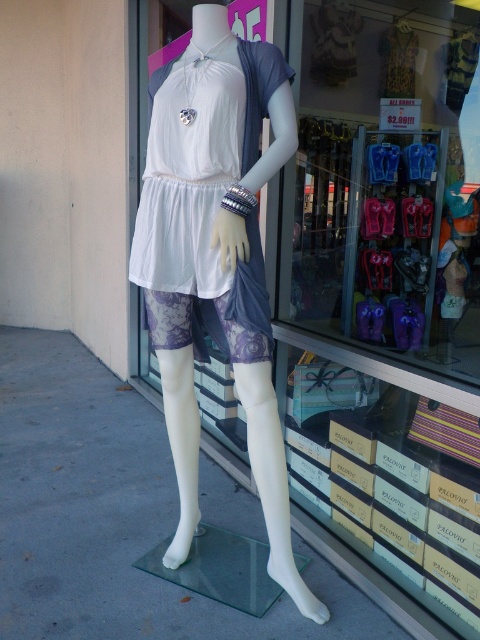
You are standing in front of the store and see two points marked on the display window. The first point is at coordinate point (393, 49) and the second is at point (288, 150). Which point is closer to you?

Point (288, 150) is closer to you because it is in front of point (393, 49).